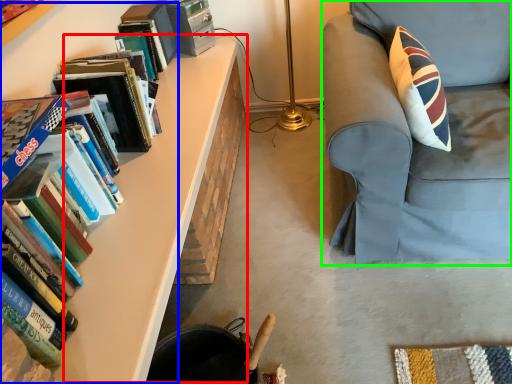
Question: Which object is positioned farthest from table (highlighted by a red box)? Select from book (highlighted by a blue box) and chair (highlighted by a green box).

Choices:
 (A) book
 (B) chair

Answer: (B)